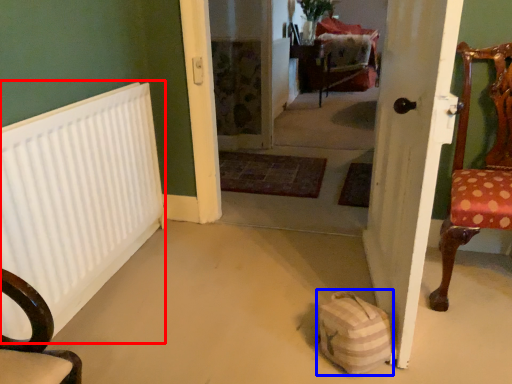
Question: Which object is further to the camera taking this photo, radiator (highlighted by a red box) or bag (highlighted by a blue box)?

Choices:
 (A) radiator
 (B) bag

Answer: (B)